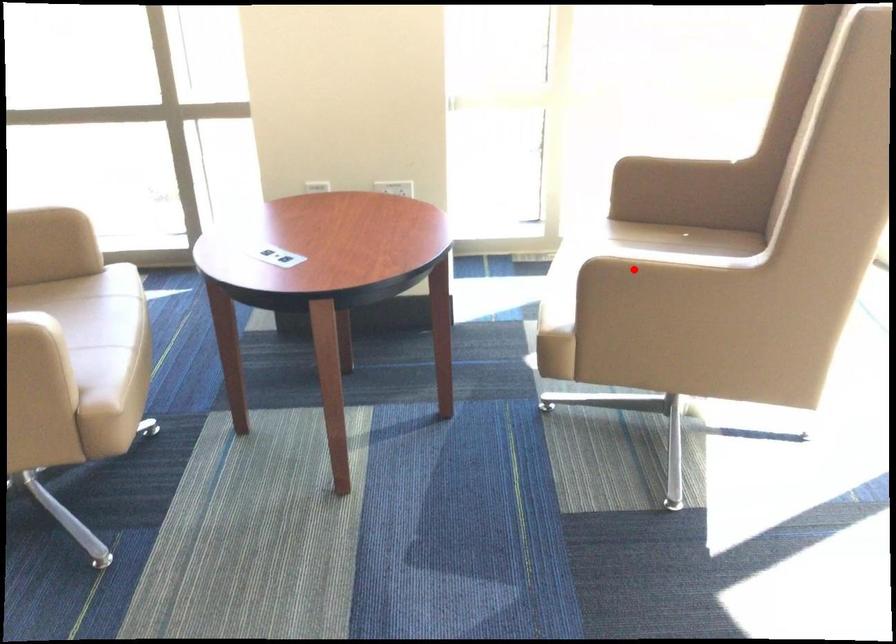
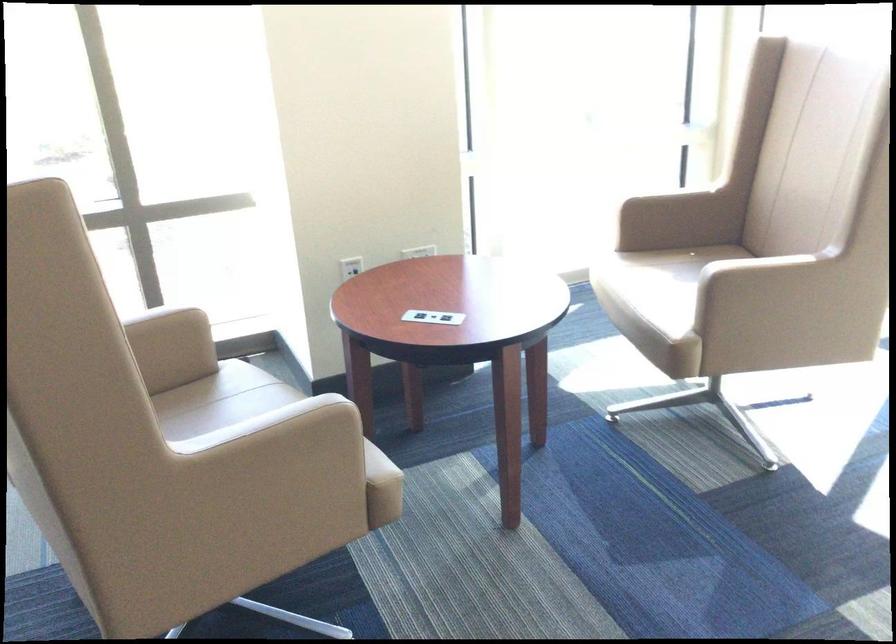
Where in the second image is the point corresponding to the highlighted location from the first image?

(744, 270)